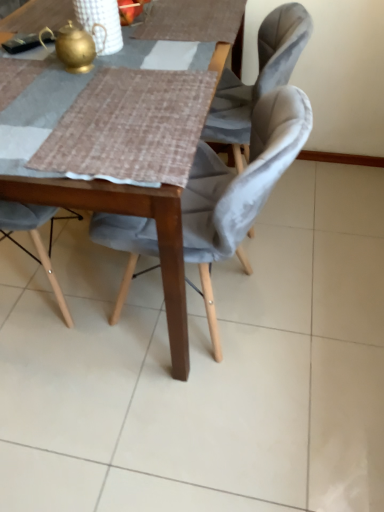
The width and height of the screenshot is (384, 512). Find the location of `free space above wooden table at center (from a real-world perspective)`. free space above wooden table at center (from a real-world perspective) is located at coordinates (100, 68).